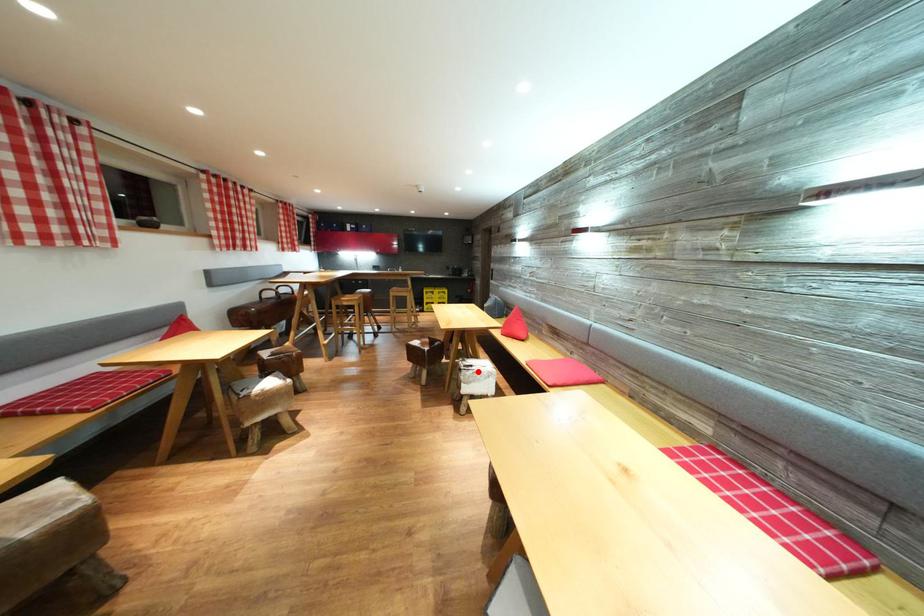
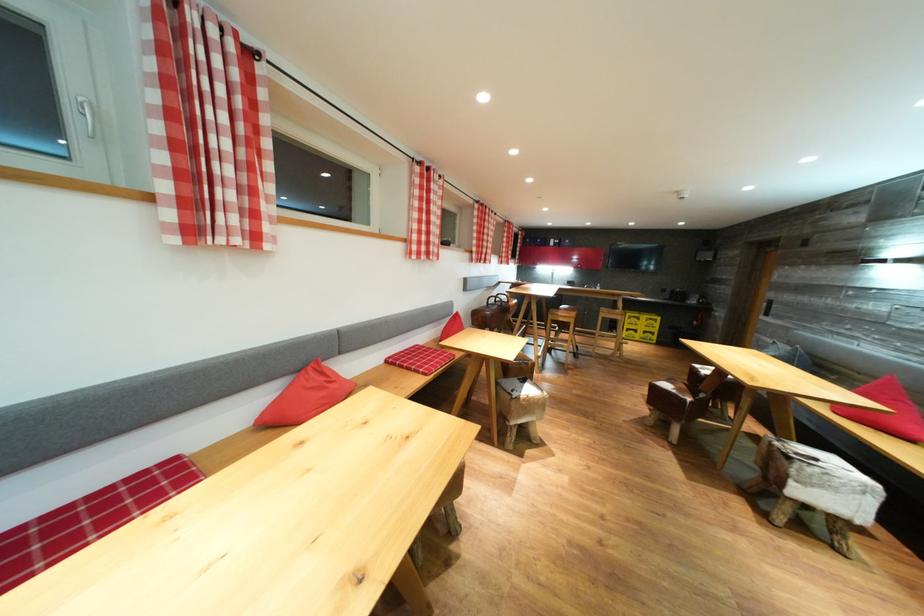
Where in the second image is the point corresponding to the highlighted location from the first image?

(821, 464)